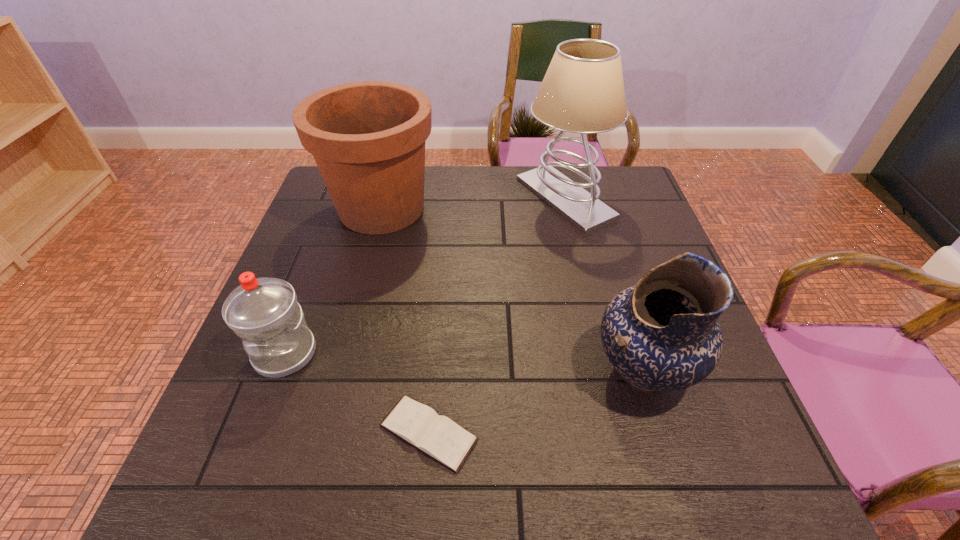
This screenshot has height=540, width=960. In order to click on vacant space at the near edge of the desktop in this screenshot , I will do `click(409, 477)`.

This screenshot has height=540, width=960. I want to click on vacant area at the left edge of the desktop, so click(291, 392).

The width and height of the screenshot is (960, 540). In order to click on free spot at the right edge of the desktop in this screenshot , I will do 661,397.

The height and width of the screenshot is (540, 960). Find the location of `vacant space at the far left corner of the desktop`. vacant space at the far left corner of the desktop is located at coordinates (331, 198).

You are a GUI agent. You are given a task and a screenshot of the screen. Output one action in this format:
    pyautogui.click(x=<x>, y=<y>)
    Task: Click on the vacant area that lies between the tallest object and the second shortest object
    The width and height of the screenshot is (960, 540).
    Given the screenshot: What is the action you would take?
    pyautogui.click(x=425, y=276)

At what (x,y) coordinates should I click in order to perform the action: click on free spot between the tallest object and the water bottle. Please return your answer as a coordinate pair (x, y). The width and height of the screenshot is (960, 540). Looking at the image, I should click on (425, 276).

You are a GUI agent. You are given a task and a screenshot of the screen. Output one action in this format:
    pyautogui.click(x=<x>, y=<y>)
    Task: Click on the free space between the flowerpot and the tallest object
    Image resolution: width=960 pixels, height=540 pixels.
    Given the screenshot: What is the action you would take?
    pyautogui.click(x=473, y=204)

Locate an element on the screen. vacant point located between the second shortest object and the pottery is located at coordinates (465, 362).

In order to click on vacant space in between the tallest object and the pottery in this screenshot , I will do `click(604, 284)`.

Identify the location of vacant point located between the diary and the table lamp. The width and height of the screenshot is (960, 540). (496, 315).